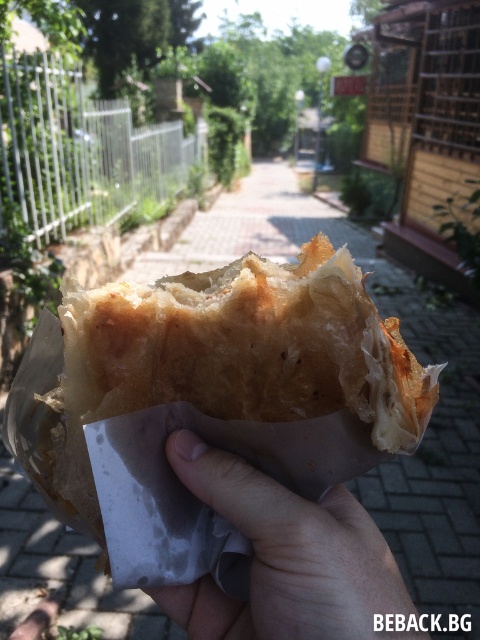
Question: Can you confirm if golden crispy pastry at center is thinner than light skin textured hand at center?

Choices:
 (A) no
 (B) yes

Answer: (A)

Question: Which point is farther to the camera?

Choices:
 (A) (224, 365)
 (B) (350, 582)

Answer: (A)

Question: Which of the following is the farthest from the observer?

Choices:
 (A) (245, 365)
 (B) (187, 448)

Answer: (B)

Question: Can you confirm if golden crispy pastry at center is positioned below light skin textured hand at center?

Choices:
 (A) yes
 (B) no

Answer: (B)

Question: Can you confirm if golden crispy pastry at center is positioned below light skin textured hand at center?

Choices:
 (A) no
 (B) yes

Answer: (A)